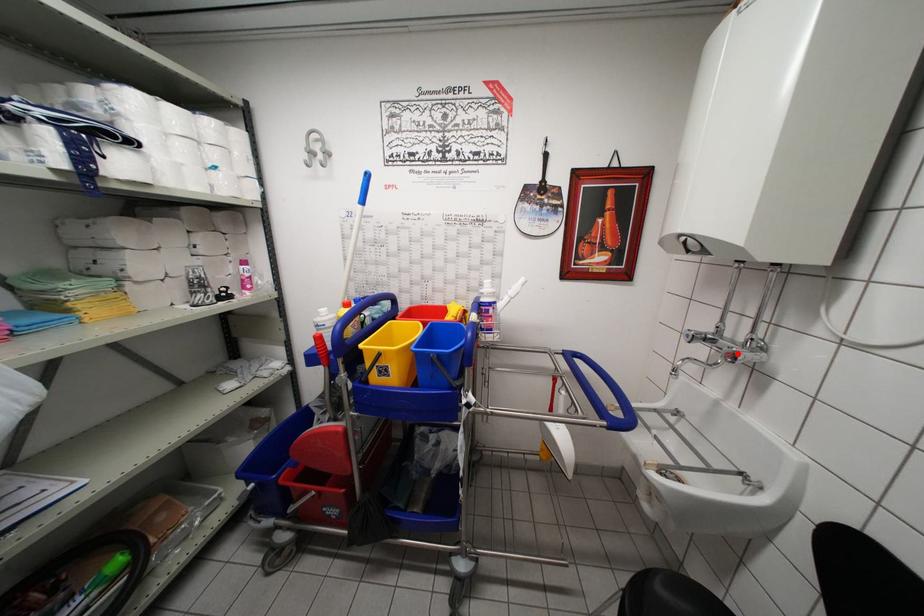
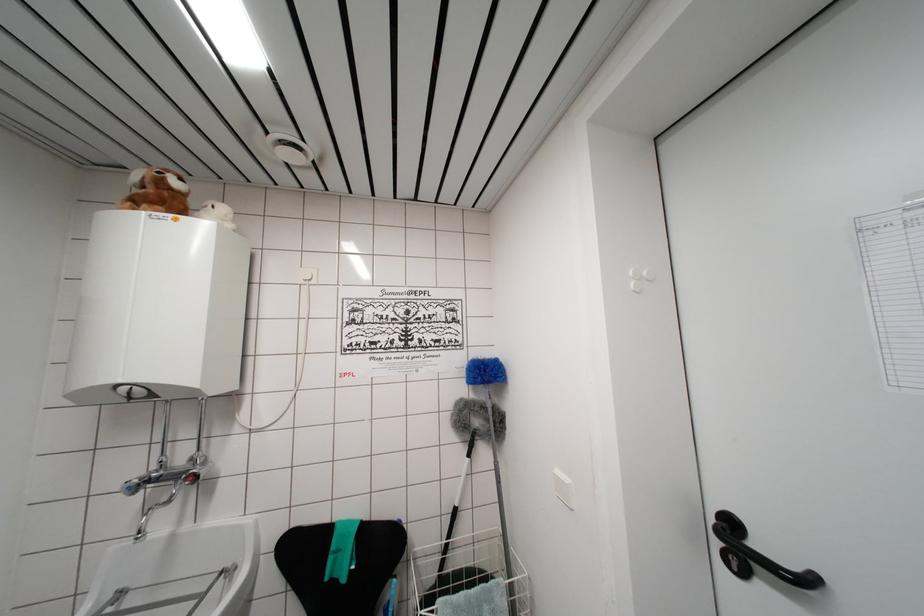
Find the pixel in the second image that matches the highlighted location in the first image.

(197, 476)